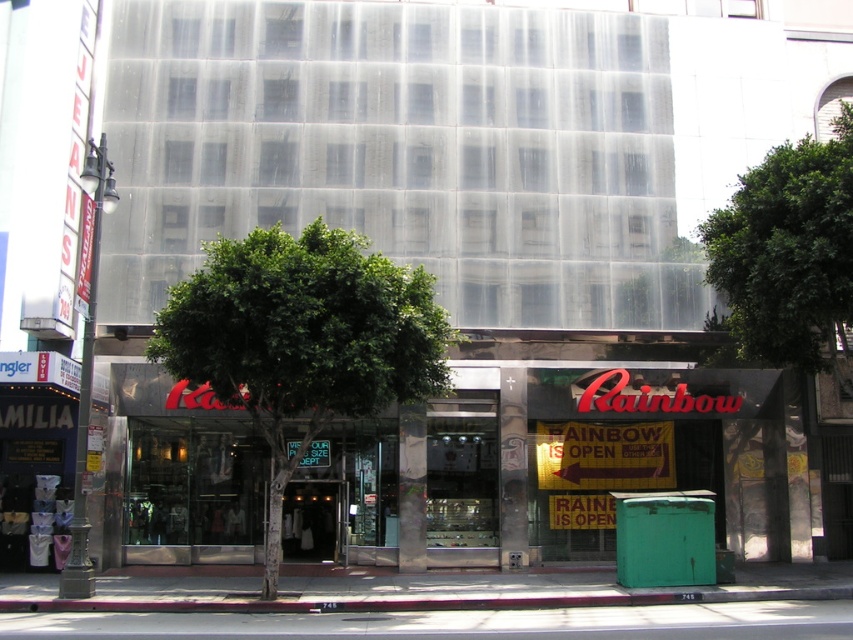
Question: Can you confirm if green leafy tree at center is smaller than green leafy tree at upper right?

Choices:
 (A) no
 (B) yes

Answer: (A)

Question: Which of the following is the closest to the observer?

Choices:
 (A) green leafy tree at center
 (B) green leafy tree at upper right

Answer: (A)

Question: Is green leafy tree at center further to the viewer compared to green leafy tree at upper right?

Choices:
 (A) no
 (B) yes

Answer: (A)

Question: In this image, where is green leafy tree at center located relative to green leafy tree at upper right?

Choices:
 (A) left
 (B) right

Answer: (A)

Question: Among these objects, which one is farthest from the camera?

Choices:
 (A) green leafy tree at upper right
 (B) green leafy tree at center

Answer: (A)

Question: Which of the following is the closest to the observer?

Choices:
 (A) green leafy tree at center
 (B) green leafy tree at upper right

Answer: (A)